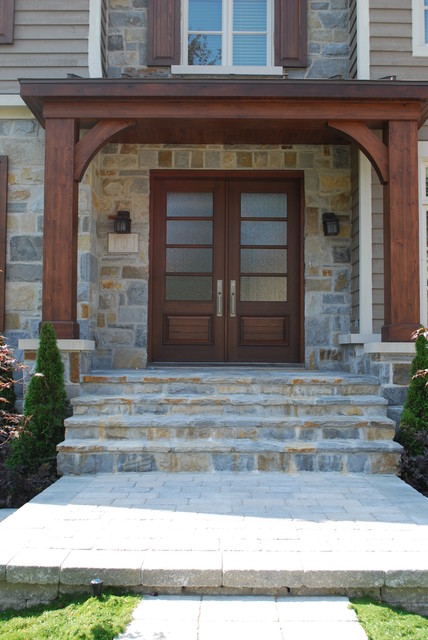
Find the location of a particular element. This screenshot has width=428, height=640. natural brick wall is located at coordinates (328, 285), (114, 314).